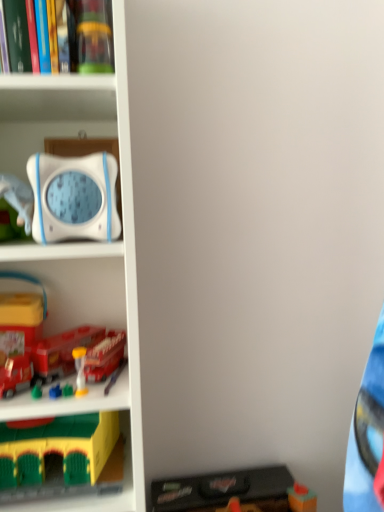
In order to click on vacant space situated above black plastic toy at lower right, the fourth toy viewed from the top (from a real-world perspective) in this screenshot , I will do `click(246, 476)`.